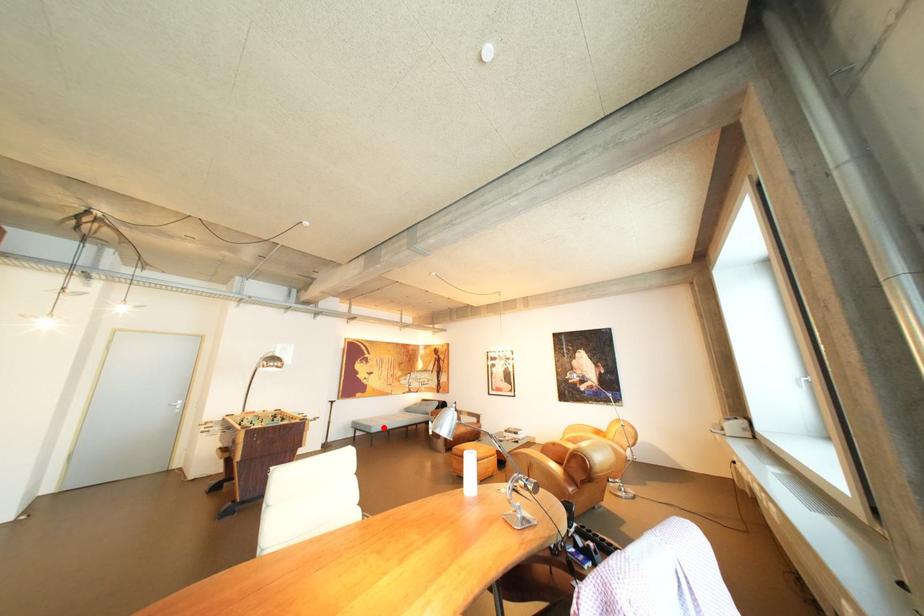
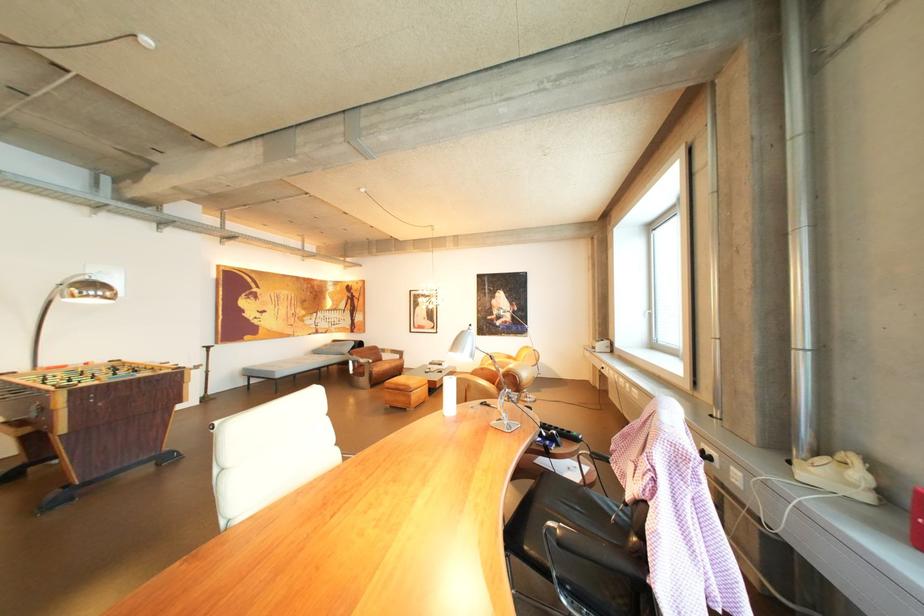
Locate, in the second image, the point that corresponds to the highlighted location in the first image.

(286, 373)